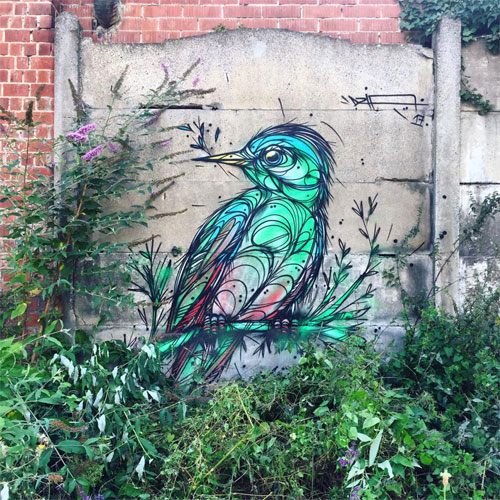
At what (x,y) coordinates should I click in order to perform the action: click on brick wall. Please return your answer as a coordinate pair (x, y). Looking at the image, I should click on (166, 17).